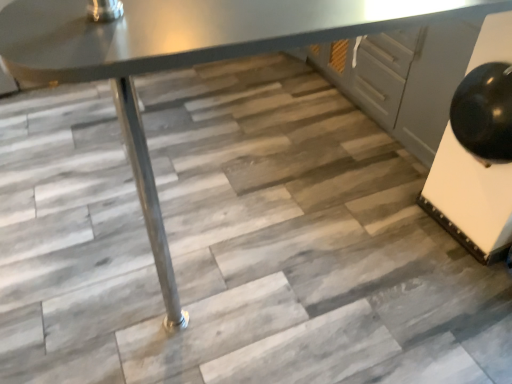
Question: Should I look upward or downward to see matte gray cabinet at center?

Choices:
 (A) up
 (B) down

Answer: (A)